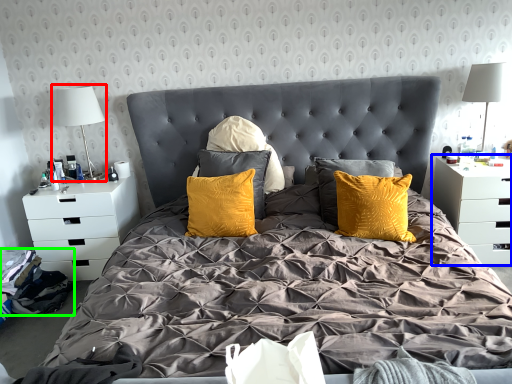
Question: Considering the real-world distances, which object is farthest from table lamp (highlighted by a red box)? nightstand (highlighted by a blue box) or material (highlighted by a green box)?

Choices:
 (A) nightstand
 (B) material

Answer: (A)